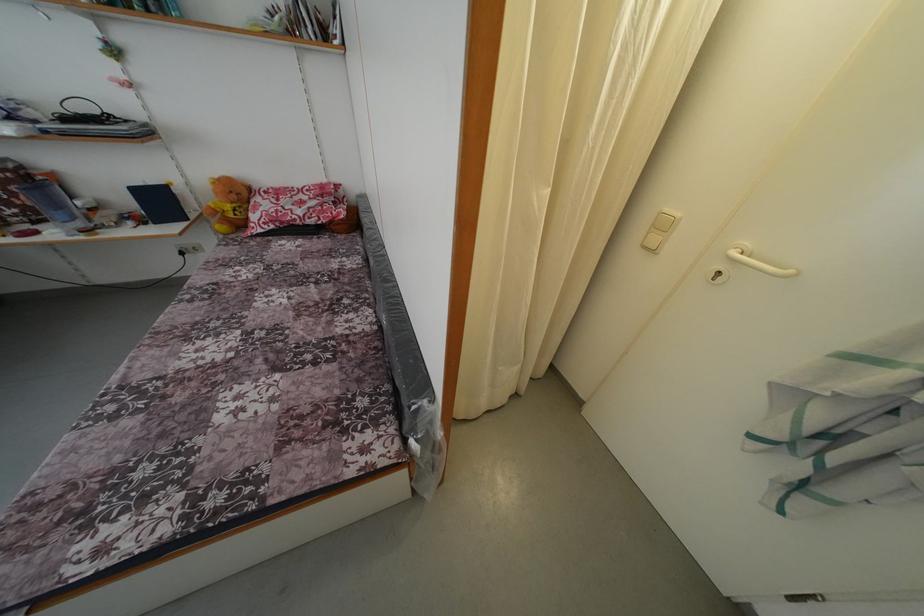
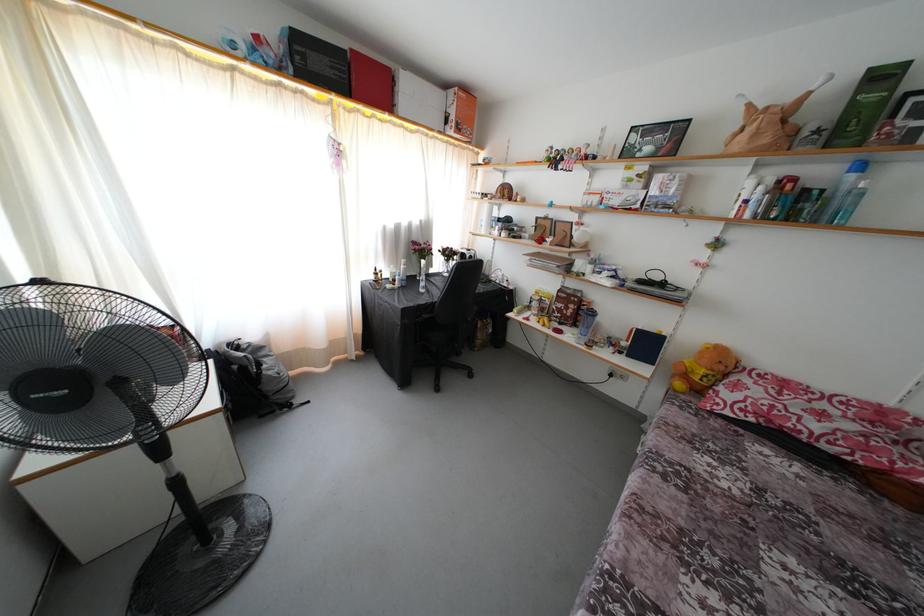
Where in the second image is the point corresponding to (239,203) from the first image?

(726, 373)